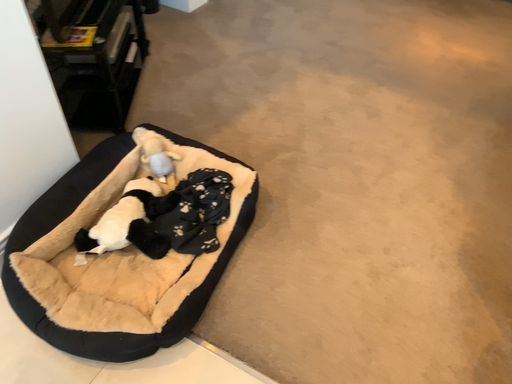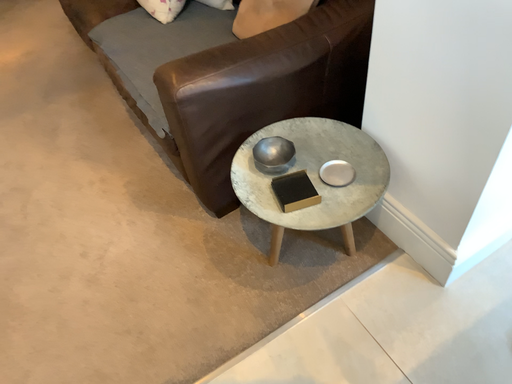
Question: Which way did the camera rotate in the video?

Choices:
 (A) rotated left
 (B) rotated right

Answer: (B)